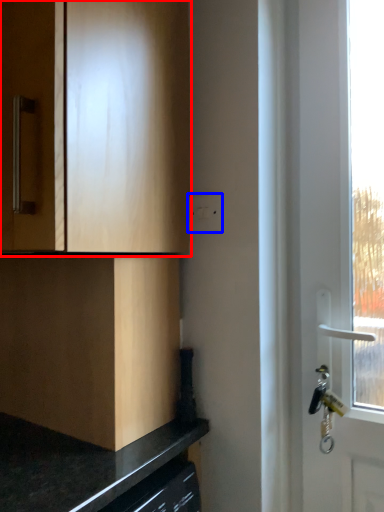
Question: Which point is further to the camera, cabinetry (highlighted by a red box) or electric outlet (highlighted by a blue box)?

Choices:
 (A) cabinetry
 (B) electric outlet

Answer: (B)